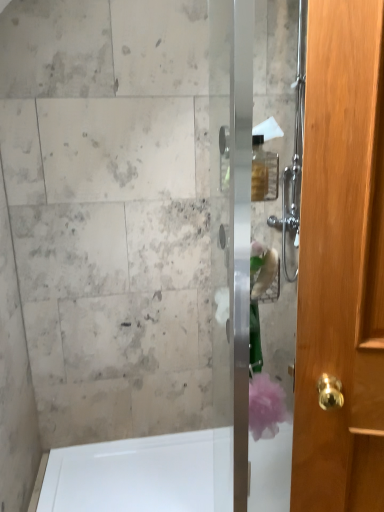
Question: In terms of height, does white glossy bathtub at lower left look taller or shorter compared to clear glass shower door at center?

Choices:
 (A) short
 (B) tall

Answer: (A)

Question: Is white glossy bathtub at lower left bigger or smaller than clear glass shower door at center?

Choices:
 (A) big
 (B) small

Answer: (A)

Question: Is point (213, 455) closer or farther from the camera than point (253, 370)?

Choices:
 (A) closer
 (B) farther

Answer: (B)

Question: Considering the positions of clear glass shower door at center and white glossy bathtub at lower left in the image, is clear glass shower door at center taller or shorter than white glossy bathtub at lower left?

Choices:
 (A) short
 (B) tall

Answer: (B)

Question: Based on their sizes in the image, would you say clear glass shower door at center is bigger or smaller than white glossy bathtub at lower left?

Choices:
 (A) small
 (B) big

Answer: (A)

Question: Does point (258, 415) appear closer or farther from the camera than point (100, 448)?

Choices:
 (A) farther
 (B) closer

Answer: (B)

Question: From the image's perspective, is clear glass shower door at center positioned above or below white glossy bathtub at lower left?

Choices:
 (A) above
 (B) below

Answer: (A)